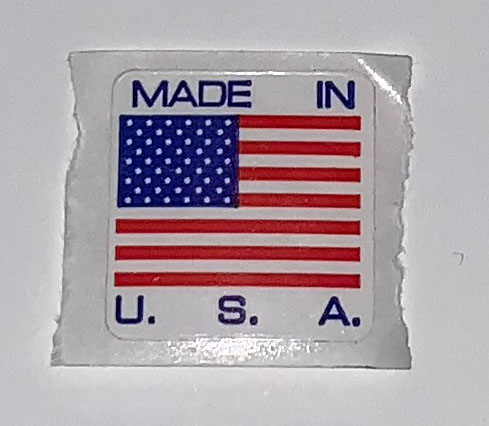
Where is `curved corner`? The width and height of the screenshot is (489, 426). curved corner is located at coordinates pos(119,78), pos(364,81), pos(363,334), pos(108,334).